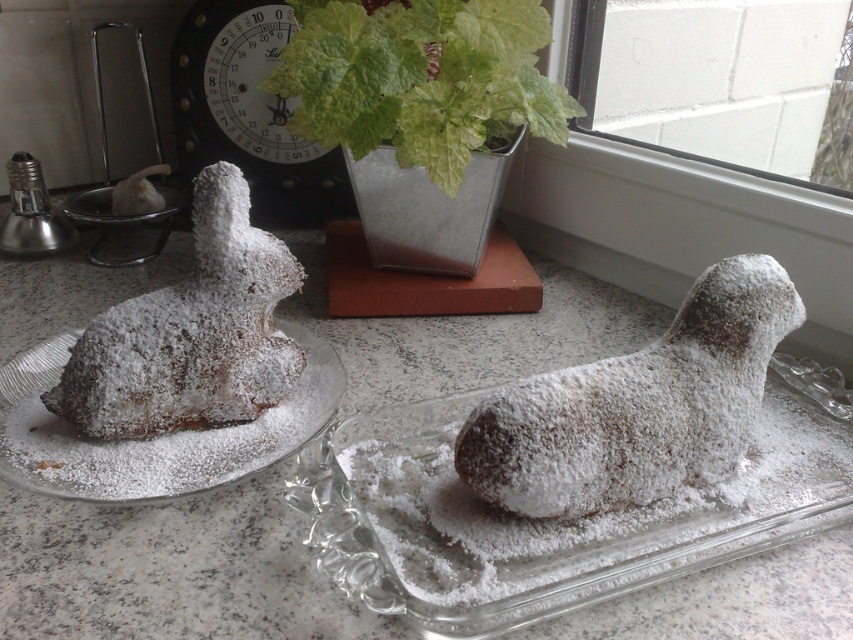
Is powdered sugar bunny at left shorter than powdered sugar pastry at left?

In fact, powdered sugar bunny at left may be taller than powdered sugar pastry at left.

Is point (201, 212) closer to camera compared to point (100, 458)?

No, (201, 212) is further to viewer.

Locate an element on the screen. This screenshot has width=853, height=640. powdered sugar bunny at left is located at coordinates (190, 333).

Is powdered sugar-coated lamb at center in front of powdered sugar bunny at left?

Result: Yes.

Can you confirm if powdered sugar-coated lamb at center is smaller than powdered sugar bunny at left?

Actually, powdered sugar-coated lamb at center might be larger than powdered sugar bunny at left.

Between point (573, 458) and point (160, 362), which one is positioned behind?

Positioned behind is point (160, 362).

Where is `powdered sugar-coated lamb at center`? powdered sugar-coated lamb at center is located at coordinates (637, 406).

Does point (689, 323) come closer to viewer compared to point (65, 460)?

Yes, point (689, 323) is in front of point (65, 460).

Can you confirm if powdered sugar-coated lamb at center is positioned above powdered sugar pastry at left?

No.

Identify the location of powdered sugar-coated lamb at center. (637, 406).